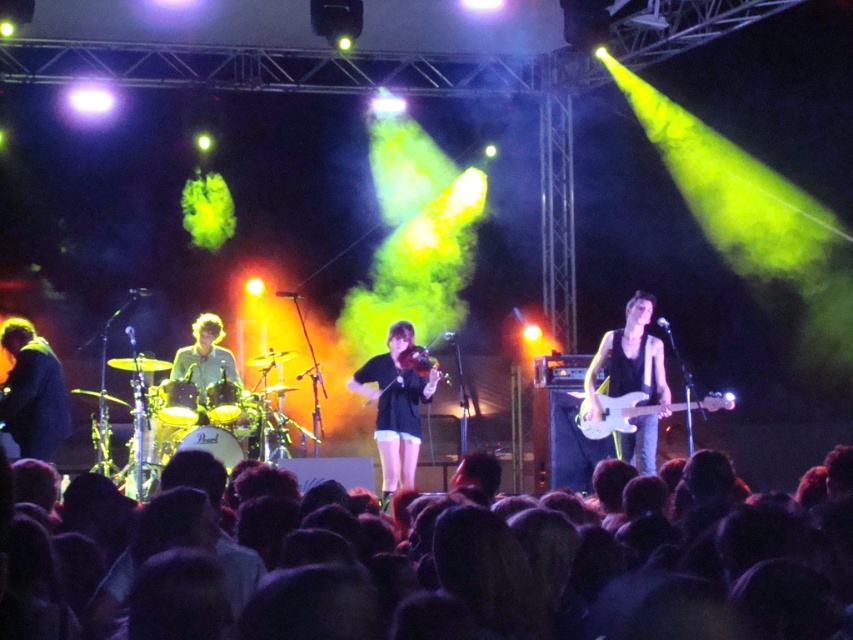
You are a photographer at the concert and want to capture a photo where the black matte shirt at center is clearly visible above the white glossy electric guitar at center. Based on the scene, can you position yourself in a way to achieve this?

The black matte shirt at center is taller than the white glossy electric guitar at center, so positioning yourself at a lower angle or closer to the base of the stage would allow the black matte shirt at center to naturally appear above the white glossy electric guitar at center in the photo.

You are a photographer at the concert and want to capture a shot of the white glossy guitar at center and the black matte shirt at center. Based on their positions, which object should you focus on first if you want to frame them both in a single shot from your current position?

The white glossy guitar at center is to the right of the black matte shirt at center. To frame both in a single shot, focus on the black matte shirt at center first as it is closer to your current position, then adjust the camera to include the white glossy guitar at center on the right side.